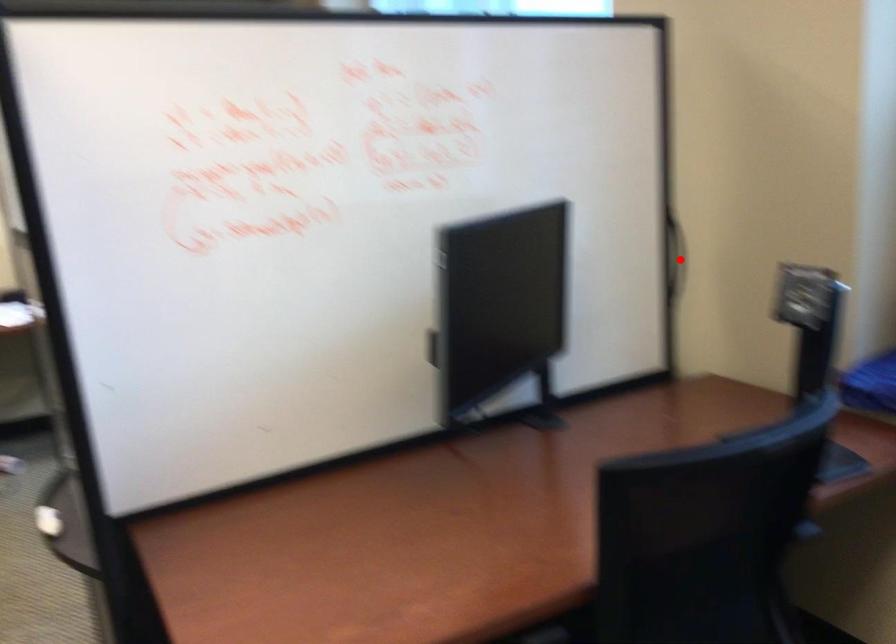
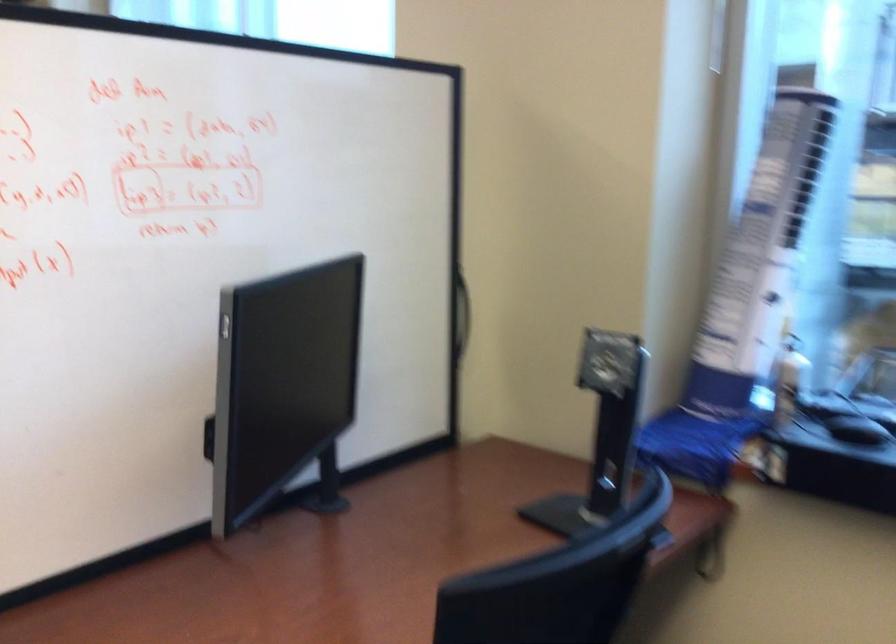
The point at the highlighted location is marked in the first image. Where is the corresponding point in the second image?

(461, 313)